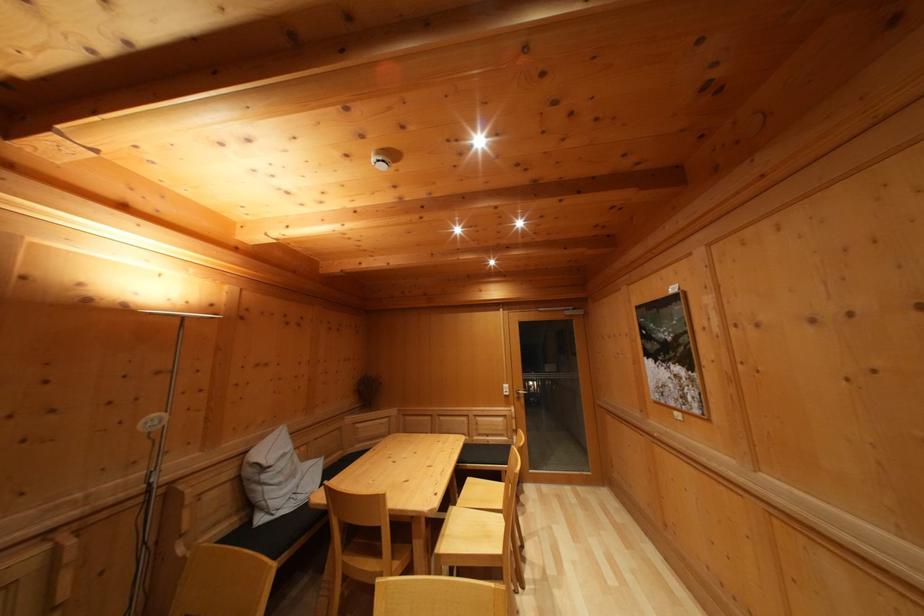
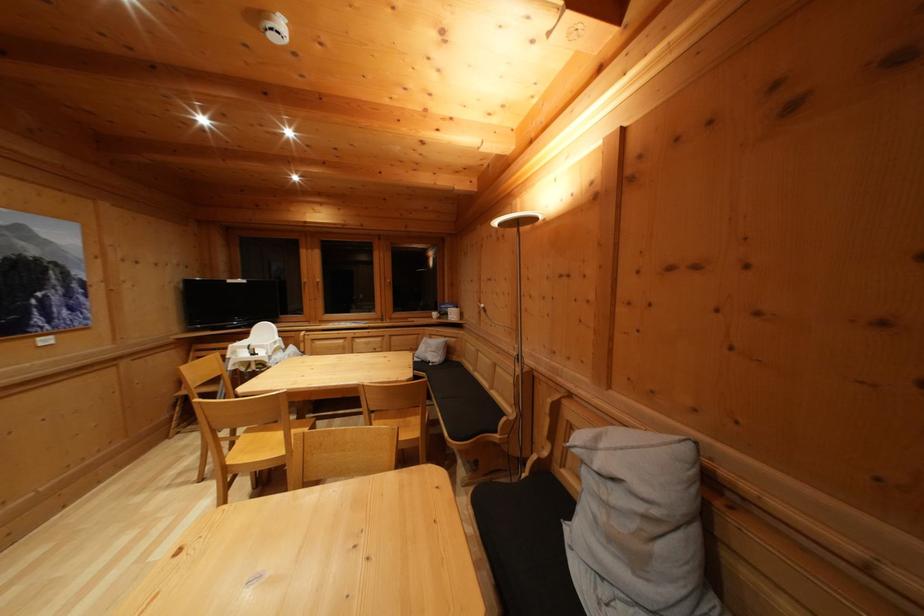
Locate, in the second image, the point that corresponds to (298,480) in the first image.

(640, 565)